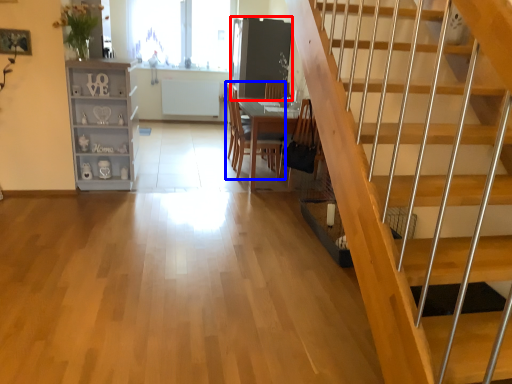
Question: Which point is further to the camera, glass door (highlighted by a red box) or chair (highlighted by a blue box)?

Choices:
 (A) glass door
 (B) chair

Answer: (A)